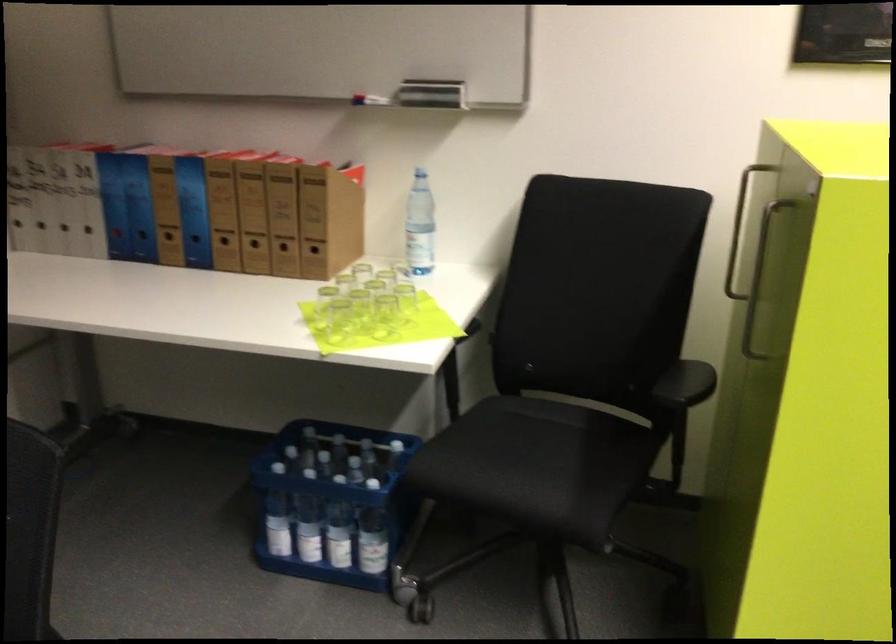
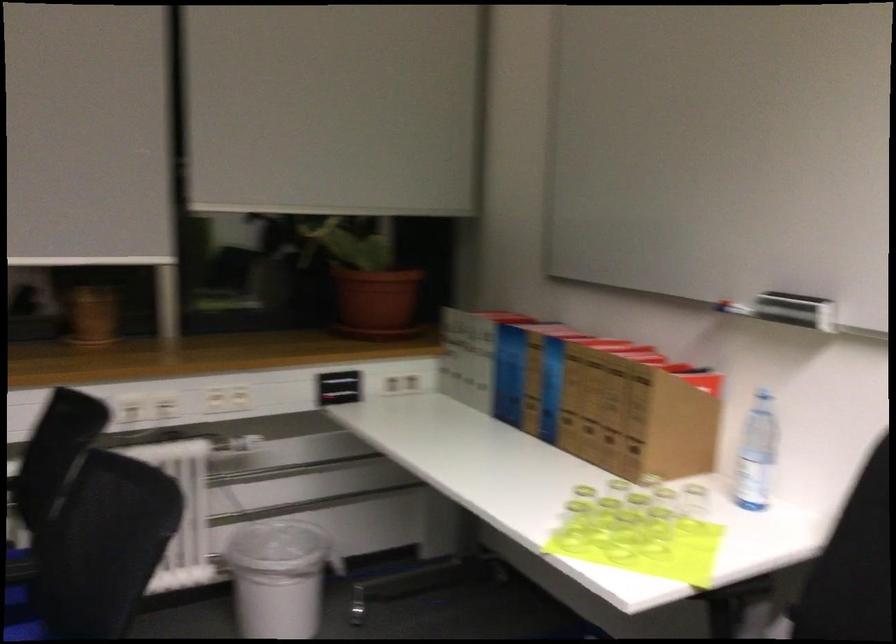
Question: I am providing you with two images of the same scene from different viewpoints. After the viewpoint changes to image2, which objects are now occluded?

Choices:
 (A) black chair sitting surface
 (B) blue file binder
 (C) whiteboard eraser
 (D) none of these

Answer: (D)